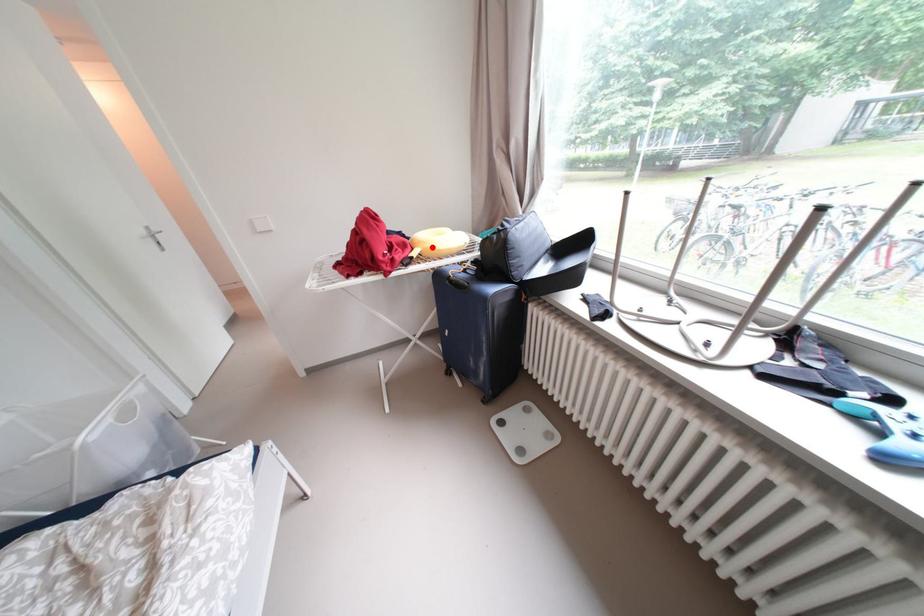
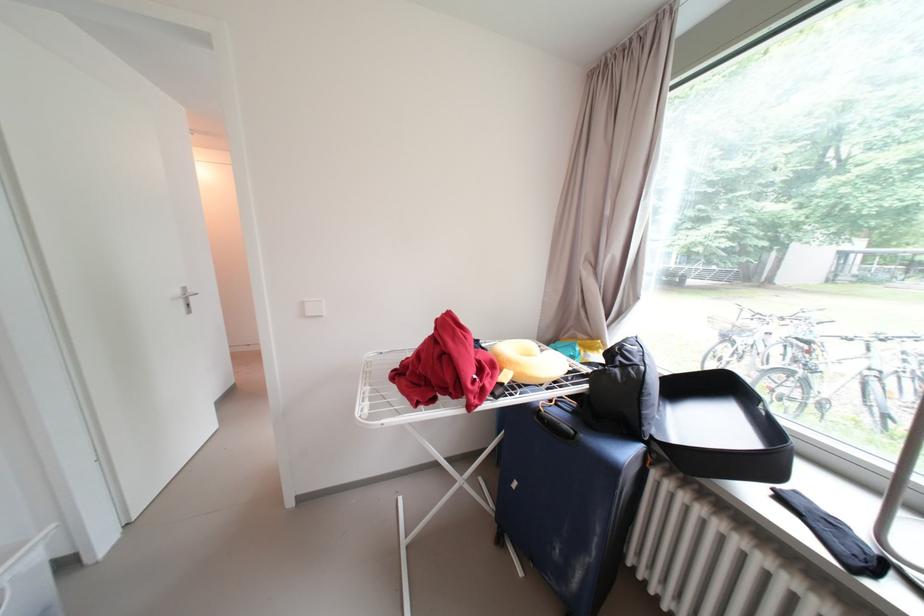
Where in the second image is the point corresponding to the highlighted location from the first image?

(527, 371)